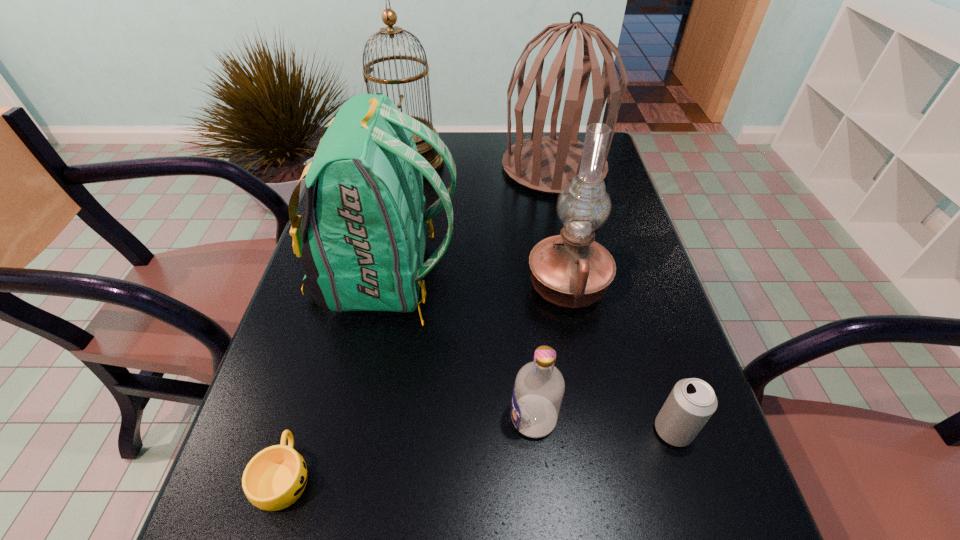
The width and height of the screenshot is (960, 540). What are the coordinates of `vacant area between the oil lamp and the second shortest object` in the screenshot? It's located at (620, 358).

The width and height of the screenshot is (960, 540). I want to click on free space between the left birdcage and the vodka, so click(470, 291).

Identify the location of vacant area that lies between the right birdcage and the oil lamp. (561, 226).

Where is `unoccupied position between the backpack and the second shortest object`? This screenshot has height=540, width=960. unoccupied position between the backpack and the second shortest object is located at coordinates (530, 354).

At what (x,y) coordinates should I click in order to perform the action: click on free spot between the oil lamp and the left birdcage. Please return your answer as a coordinate pair (x, y). The width and height of the screenshot is (960, 540). Looking at the image, I should click on (488, 224).

At what (x,y) coordinates should I click in order to perform the action: click on free area in between the right birdcage and the beer can. Please return your answer as a coordinate pair (x, y). This screenshot has width=960, height=540. Looking at the image, I should click on (613, 299).

Locate an element on the screen. vacant region between the left birdcage and the vodka is located at coordinates (470, 291).

Locate an element on the screen. Image resolution: width=960 pixels, height=540 pixels. object that stands as the fourth closest to the oil lamp is located at coordinates (546, 164).

In order to click on the second closest object relative to the right birdcage in this screenshot , I will do `click(364, 250)`.

I want to click on free space that satisfies the following two spatial constraints: 1. on the back of the backpack; 2. on the right side of the oil lamp, so click(x=384, y=286).